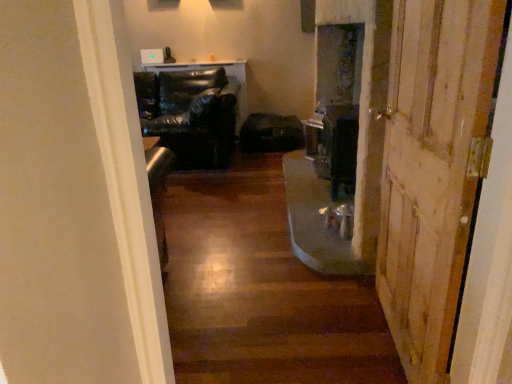
Image resolution: width=512 pixels, height=384 pixels. What do you see at coordinates (261, 292) in the screenshot?
I see `wooden floor at center` at bounding box center [261, 292].

Locate an element on the screen. Image resolution: width=512 pixels, height=384 pixels. wooden door at right is located at coordinates (434, 170).

How many degrees apart are the facing directions of black leather chair at center and wooden door at right?

They differ by 94.5 degrees in their facing directions.

Does black leather chair at center appear on the left side of wooden door at right?

Indeed, black leather chair at center is positioned on the left side of wooden door at right.

In terms of height, does black leather chair at center look taller or shorter compared to wooden door at right?

Considering their sizes, black leather chair at center has less height than wooden door at right.

Do you think black leather chair at center is within wooden door at right, or outside of it?

black leather chair at center is located beyond the bounds of wooden door at right.

From the image's perspective, which is above, wooden door at right or wooden floor at center?

From the image's view, wooden door at right is above.

Is wooden door at right facing away from wooden floor at center?

wooden door at right does not have its back to wooden floor at center.

Between wooden door at right and wooden floor at center, which one has smaller width?

wooden door at right.

From the picture: Which of these two, wooden door at right or wooden floor at center, stands shorter?

wooden floor at center.

From the picture: Which of these two, wooden floor at center or wooden door at right, is bigger?

Bigger between the two is wooden floor at center.

From a real-world perspective, is wooden floor at center physically located above or below wooden door at right?

From a real-world perspective, wooden floor at center is physically below wooden door at right.

Is wooden floor at center oriented towards wooden door at right?

No, wooden floor at center does not turn towards wooden door at right.

Can you confirm if wooden floor at center is taller than wooden door at right?

In fact, wooden floor at center may be shorter than wooden door at right.

Is point (402, 51) farther from camera compared to point (219, 167)?

No, it is not.

From the image's perspective, would you say wooden door at right is shown under black leather chair at center?

Indeed, from the image's perspective, wooden door at right is shown beneath black leather chair at center.

Would you say wooden door at right is inside or outside black leather chair at center?

The correct answer is: outside.

Which object is positioned more to the left, wooden door at right or black leather chair at center?

Positioned to the left is black leather chair at center.

Between point (234, 142) and point (198, 184), which one is positioned in front?

The point (198, 184) is closer to the camera.

Based on the photo, is black leather chair at center inside or outside of wooden floor at center?

black leather chair at center is spatially situated outside wooden floor at center.

Is black leather chair at center beside wooden floor at center?

black leather chair at center and wooden floor at center are not in contact.

Based on the photo, is black leather chair at center oriented towards wooden floor at center?

Yes.

Find the location of a particular element. This screenshot has width=512, height=384. stairwell in front of the black leather chair at center is located at coordinates (261, 292).

Can you confirm if wooden floor at center is positioned to the left of black leather chair at center?

No.

Looking at this image, does wooden floor at center have a lesser width compared to black leather chair at center?

Incorrect, the width of wooden floor at center is not less than that of black leather chair at center.

Are wooden floor at center and black leather chair at center located far from each other?

That's right, there is a large distance between wooden floor at center and black leather chair at center.

Identify the location of chair below the wooden door at right (from a real-world perspective). (192, 116).

The height and width of the screenshot is (384, 512). What are the coordinates of `stairwell below the wooden door at right (from the image's perspective)` in the screenshot? It's located at (261, 292).

From the image, which object appears to be farther from black leather chair at center, wooden floor at center or wooden door at right?

Among the two, wooden door at right is located further to black leather chair at center.

Considering their positions, is wooden door at right positioned further to black leather chair at center than wooden floor at center?

The object further to black leather chair at center is wooden door at right.

Estimate the real-world distances between objects in this image. Which object is further from wooden door at right, wooden floor at center or black leather chair at center?

Among the two, black leather chair at center is located further to wooden door at right.

Considering their positions, is black leather chair at center positioned closer to wooden door at right than wooden floor at center?

The object closer to wooden door at right is wooden floor at center.

Estimate the real-world distances between objects in this image. Which object is closer to wooden floor at center, black leather chair at center or wooden door at right?

wooden door at right is positioned closer to the anchor wooden floor at center.

Which object lies further to the anchor point wooden floor at center, wooden door at right or black leather chair at center?

black leather chair at center lies further to wooden floor at center than the other object.

The width and height of the screenshot is (512, 384). In order to click on stairwell positioned between wooden door at right and black leather chair at center from near to far in this screenshot , I will do `click(261, 292)`.